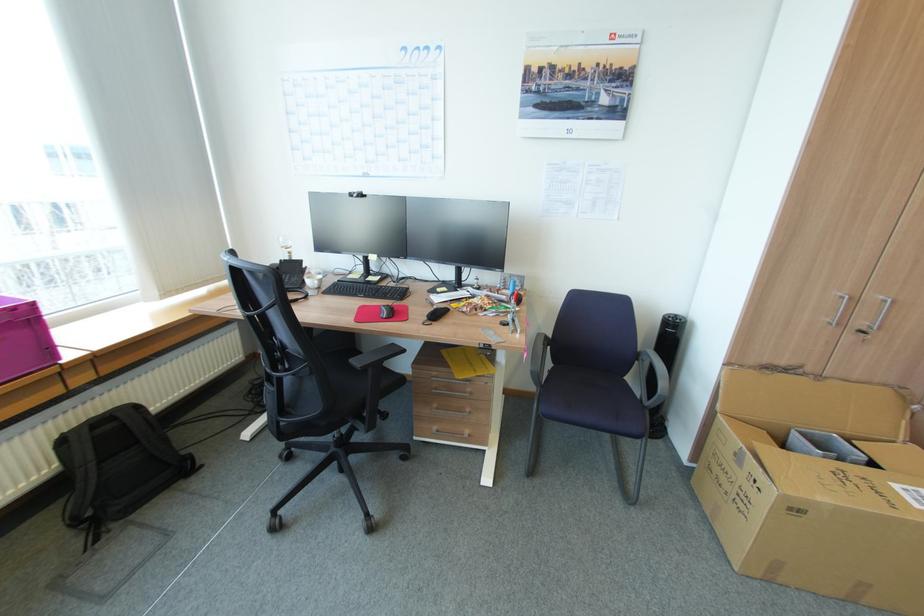
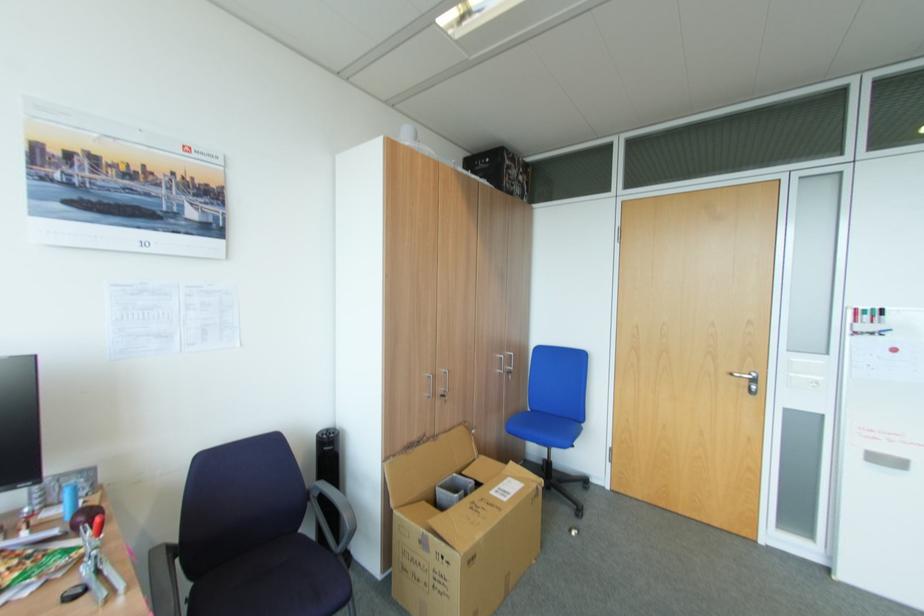
Locate, in the second image, the point that corresponds to [515,315] in the first image.

(91, 569)